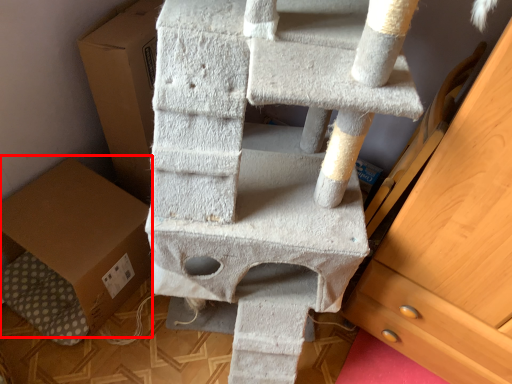
Question: Observing the image, what is the correct spatial positioning of cardboard box (annotated by the red box) in reference to chest of drawers?

Choices:
 (A) left
 (B) right

Answer: (A)